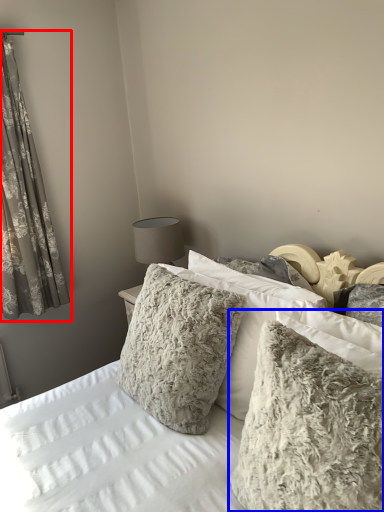
Question: Which of the following is the closest to the observer, curtain (highlighted by a red box) or pillow (highlighted by a blue box)?

Choices:
 (A) curtain
 (B) pillow

Answer: (B)